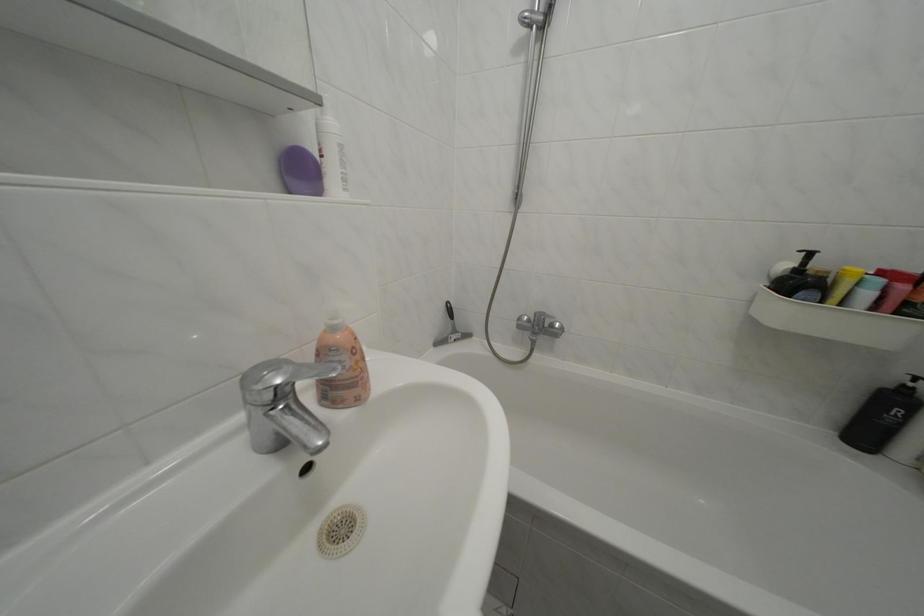
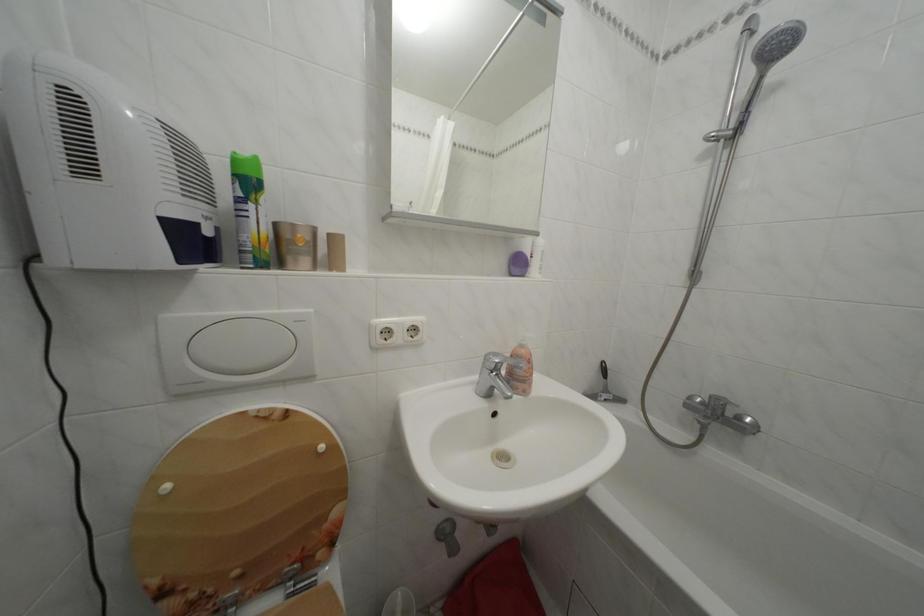
In the second image, find the point that corresponds to (464,338) in the first image.

(614, 397)